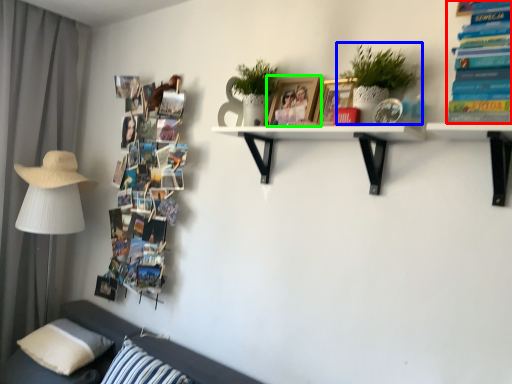
Question: Which is nearer to the book (highlighted by a red box)? houseplant (highlighted by a blue box) or picture frame (highlighted by a green box).

Choices:
 (A) houseplant
 (B) picture frame

Answer: (A)